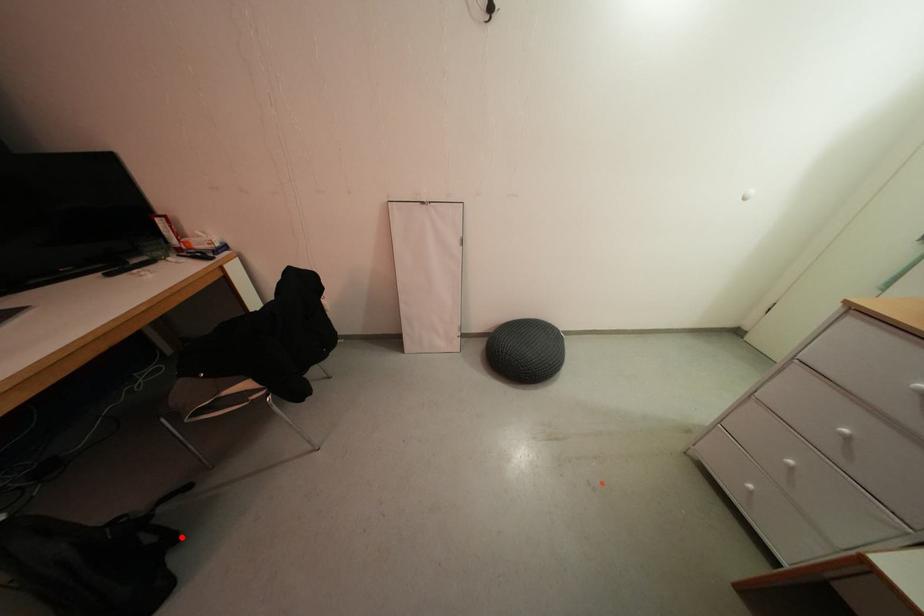
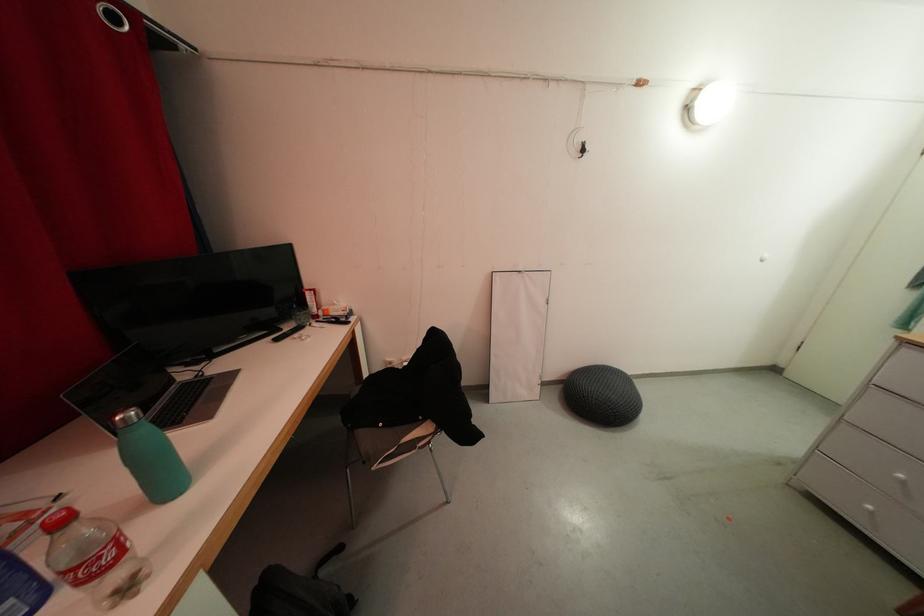
Question: I am providing you with two images of the same scene from different viewpoints. A red point is marked on the first image. Can you still see the location of the red point in image 2?

Choices:
 (A) Yes
 (B) No

Answer: (A)